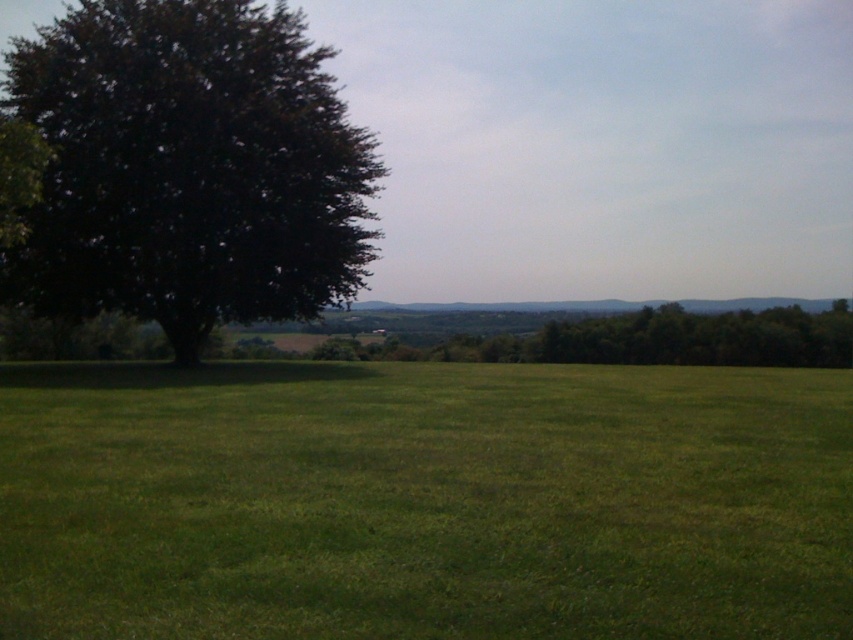
You are a gardener planning to plant a new flower bed between the green grass at center and the dark green leafy tree at left. The flower bed requires a minimum of 50 feet of space between the tree and the grass. Can you determine if there is enough space for the flower bed?

The green grass at center is 54.75 feet from the dark green leafy tree at left, which exceeds the required 50 feet. Therefore, there is enough space for the flower bed between them.

You are a drone operator trying to land a drone on the green grass at center. The drone has a GPS coordinate system where the bottom left corner of the image is the origin point. The coordinates are given as a point between 0 and 1 in both x and y axes. The point is marked as point (x=424, y=500). Is the drone safe to land on the green grass at center?

The point (x=424, y=500) marks the green grass at center, so the drone can safely land there as it is the intended location.

You are a gardener planning to mow the lawn. You have a lawnmower that can only handle areas smaller than the dark green leafy tree at left. Based on the scene, will the green grass at center be manageable with your lawnmower?

The green grass at center occupies less space than the dark green leafy tree at left, so yes, the lawnmower can handle the green grass at center since it is smaller in area than the dark green leafy tree at left which the mower is designed for.